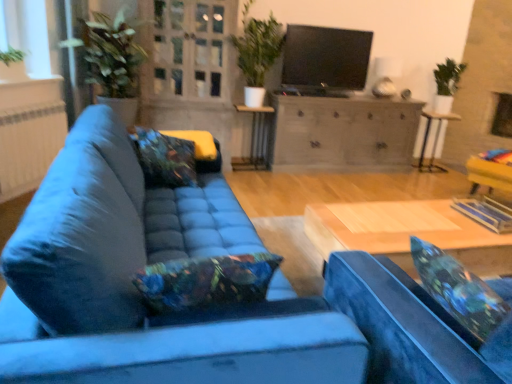
Question: Is metallic silver side table at center touching white matte window screen at upper left?

Choices:
 (A) no
 (B) yes

Answer: (A)

Question: Does metallic silver side table at center have a smaller size compared to white matte window screen at upper left?

Choices:
 (A) no
 (B) yes

Answer: (A)

Question: Is metallic silver side table at center shorter than white matte window screen at upper left?

Choices:
 (A) yes
 (B) no

Answer: (B)

Question: Are metallic silver side table at center and white matte window screen at upper left located far from each other?

Choices:
 (A) no
 (B) yes

Answer: (B)

Question: Does metallic silver side table at center have a greater width compared to white matte window screen at upper left?

Choices:
 (A) no
 (B) yes

Answer: (A)

Question: Does point (343, 102) appear closer or farther from the camera than point (202, 9)?

Choices:
 (A) farther
 (B) closer

Answer: (A)

Question: Looking at their shapes, would you say wooden cabinet at center is wider or thinner than clear glass door at upper center?

Choices:
 (A) thin
 (B) wide

Answer: (B)

Question: Relative to clear glass door at upper center, is wooden cabinet at center in front or behind?

Choices:
 (A) front
 (B) behind

Answer: (B)

Question: From the image's perspective, is wooden cabinet at center positioned above or below clear glass door at upper center?

Choices:
 (A) below
 (B) above

Answer: (A)

Question: Does point (404, 263) appear closer or farther from the camera than point (260, 36)?

Choices:
 (A) closer
 (B) farther

Answer: (A)

Question: From the image's perspective, relative to green matte plant at upper center, is wooden coffee table at center above or below?

Choices:
 (A) above
 (B) below

Answer: (B)

Question: Considering the positions of wooden coffee table at center and green matte plant at upper center in the image, is wooden coffee table at center wider or thinner than green matte plant at upper center?

Choices:
 (A) thin
 (B) wide

Answer: (B)

Question: Would you say wooden coffee table at center is inside or outside green matte plant at upper center?

Choices:
 (A) inside
 (B) outside

Answer: (B)

Question: From their relative heights in the image, would you say white matte window screen at upper left is taller or shorter than clear glass door at upper center?

Choices:
 (A) short
 (B) tall

Answer: (A)

Question: Is white matte window screen at upper left spatially inside clear glass door at upper center, or outside of it?

Choices:
 (A) outside
 (B) inside

Answer: (A)